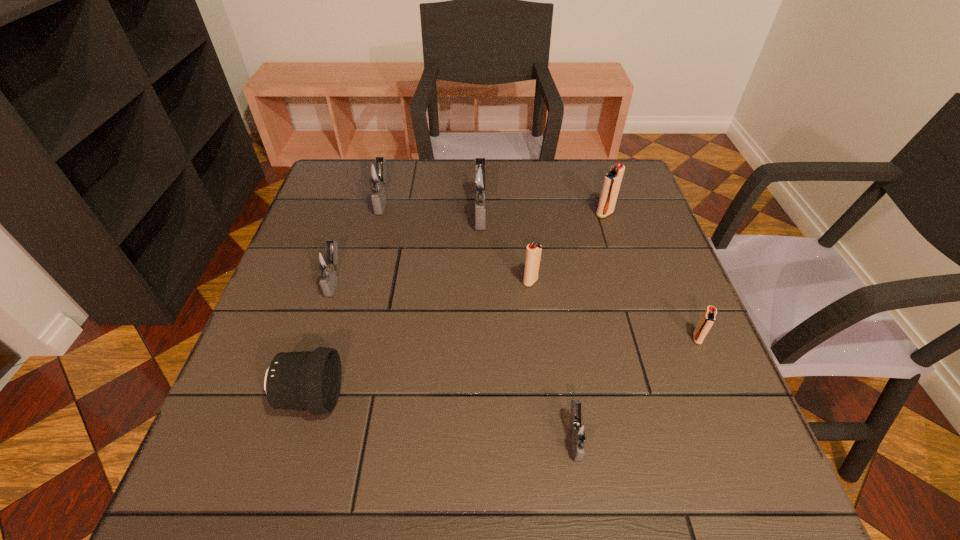
At what (x,y) coordinates should I click in order to perform the action: click on the fifth igniter from right to left. Please return your answer as a coordinate pair (x, y). The width and height of the screenshot is (960, 540). Looking at the image, I should click on (480, 178).

At what (x,y) coordinates should I click in order to perform the action: click on the third gray igniter from left to right. Please return your answer as a coordinate pair (x, y). Image resolution: width=960 pixels, height=540 pixels. Looking at the image, I should click on (480, 178).

Identify the location of the farthest red igniter. The height and width of the screenshot is (540, 960). (612, 180).

Locate an element on the screen. This screenshot has width=960, height=540. the second red igniter from right to left is located at coordinates (612, 180).

Where is `the second biggest gray igniter`? the second biggest gray igniter is located at coordinates tap(375, 173).

Where is `the second smallest gray igniter`? the second smallest gray igniter is located at coordinates (325, 261).

Find the location of a particular element. the fourth igniter from left to right is located at coordinates (533, 252).

This screenshot has width=960, height=540. Find the location of `the second farthest red igniter`. the second farthest red igniter is located at coordinates (533, 252).

I want to click on black telephoto lens, so click(309, 380).

Find the location of a particular element. The height and width of the screenshot is (540, 960). the rightmost object is located at coordinates point(706,322).